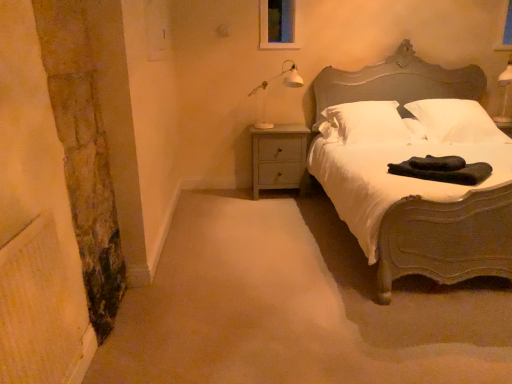
Question: Is dark green fabric at bed bigger than white glossy lamp at upper right?

Choices:
 (A) yes
 (B) no

Answer: (B)

Question: Is dark green fabric at bed facing away from white glossy lamp at upper right?

Choices:
 (A) no
 (B) yes

Answer: (A)

Question: Does dark green fabric at bed turn towards white glossy lamp at upper right?

Choices:
 (A) no
 (B) yes

Answer: (A)

Question: Is dark green fabric at bed positioned far away from white glossy lamp at upper right?

Choices:
 (A) yes
 (B) no

Answer: (A)

Question: From the image's perspective, is dark green fabric at bed on white glossy lamp at upper right?

Choices:
 (A) no
 (B) yes

Answer: (A)

Question: Would you say matte gray bed at right is inside or outside white glossy lamp at upper right?

Choices:
 (A) outside
 (B) inside

Answer: (A)

Question: Is matte gray bed at right bigger or smaller than white glossy lamp at upper right?

Choices:
 (A) big
 (B) small

Answer: (A)

Question: From the image's perspective, relative to white glossy lamp at upper right, is matte gray bed at right above or below?

Choices:
 (A) below
 (B) above

Answer: (A)

Question: From their relative heights in the image, would you say matte gray bed at right is taller or shorter than white glossy lamp at upper right?

Choices:
 (A) short
 (B) tall

Answer: (B)

Question: Does point (493, 127) appear closer or farther from the camera than point (508, 228)?

Choices:
 (A) closer
 (B) farther

Answer: (B)

Question: In the image, is white soft pillow at upper right, the second pillow positioned from the left, positioned in front of or behind matte gray bed at right?

Choices:
 (A) front
 (B) behind

Answer: (B)

Question: From a real-world perspective, is white soft pillow at upper right, which ranks as the 1th pillow in right-to-left order, physically located above or below matte gray bed at right?

Choices:
 (A) above
 (B) below

Answer: (A)

Question: From the image's perspective, relative to matte gray bed at right, is white soft pillow at upper right, the second pillow positioned from the left, above or below?

Choices:
 (A) above
 (B) below

Answer: (A)

Question: Is white painted wood nightstand at lower left to the left or to the right of transparent glass window at upper center in the image?

Choices:
 (A) left
 (B) right

Answer: (A)

Question: Is white painted wood nightstand at lower left bigger or smaller than transparent glass window at upper center?

Choices:
 (A) small
 (B) big

Answer: (B)